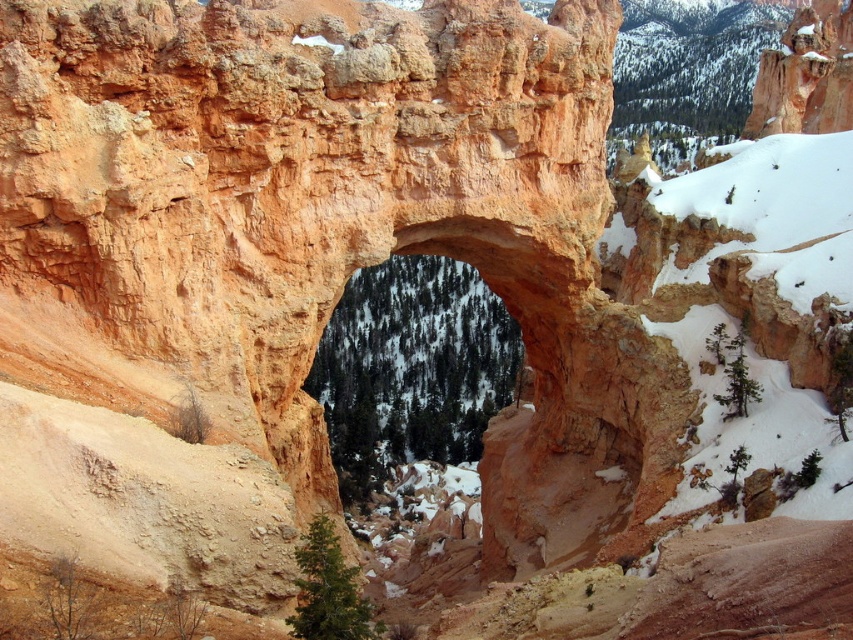
Can you confirm if green textured tree at center is shorter than green matte tree at lower left?

In fact, green textured tree at center may be taller than green matte tree at lower left.

Is point (415, 420) farther from camera compared to point (73, 556)?

Yes, point (415, 420) is farther from viewer.

The width and height of the screenshot is (853, 640). Find the location of `green textured tree at center`. green textured tree at center is located at coordinates (410, 369).

Does green matte tree at lower left appear over green matte tree at upper right?

Actually, green matte tree at lower left is below green matte tree at upper right.

Which is above, green matte tree at lower left or green matte tree at upper right?

green matte tree at upper right

Locate an element on the screen. The width and height of the screenshot is (853, 640). green matte tree at lower left is located at coordinates (70, 600).

Which is below, green textured tree at center or green matte tree at upper right?

Positioned lower is green textured tree at center.

What do you see at coordinates (410, 369) in the screenshot? I see `green textured tree at center` at bounding box center [410, 369].

Find the location of a particular element. The image size is (853, 640). green textured tree at center is located at coordinates (410, 369).